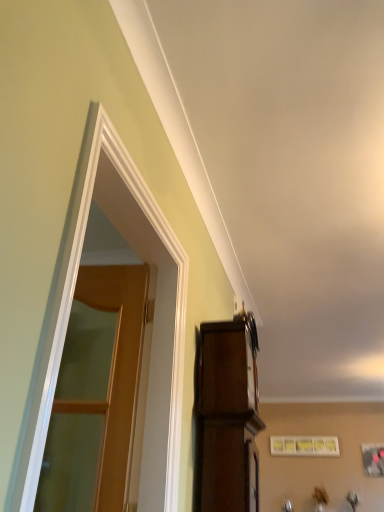
You are a GUI agent. You are given a task and a screenshot of the screen. Output one action in this format:
    pyautogui.click(x=<x>, y=<y>)
    Task: Click on the matte white picture frame at upper center
    
    Given the screenshot: What is the action you would take?
    pyautogui.click(x=304, y=445)

In order to face wooden at left, should I rotate leftwards or rightwards?

It's best to rotate left around 12.931 degrees.

This screenshot has width=384, height=512. Find the location of `dark wood cabinet at upper right`. dark wood cabinet at upper right is located at coordinates (226, 417).

Is white glossy door at left thinner than dark wood cabinet at upper right?

Yes, white glossy door at left is thinner than dark wood cabinet at upper right.

From a real-world perspective, which is physically above, white glossy door at left or dark wood cabinet at upper right?

A: white glossy door at left is physically above.

Which of these two, white glossy door at left or dark wood cabinet at upper right, is smaller?

With smaller size is dark wood cabinet at upper right.

Is wooden at left with dark wood cabinet at upper right?

No, wooden at left is not touching dark wood cabinet at upper right.

Between point (41, 485) and point (245, 335), which one is positioned behind?

Positioned behind is point (41, 485).

Considering the sizes of objects wooden at left and dark wood cabinet at upper right in the image provided, who is bigger, wooden at left or dark wood cabinet at upper right?

dark wood cabinet at upper right.

In order to click on cabinetry located below the wooden at left (from the image's perspective) in this screenshot , I will do `click(226, 417)`.

Does dark wood cabinet at upper right lie behind matte white picture frame at upper center?

No, it is in front of matte white picture frame at upper center.

Does dark wood cabinet at upper right touch matte white picture frame at upper center?

No.

In the image, is dark wood cabinet at upper right on the left side or the right side of matte white picture frame at upper center?

Clearly, dark wood cabinet at upper right is on the left of matte white picture frame at upper center in the image.

Considering the sizes of dark wood cabinet at upper right and matte white picture frame at upper center in the image, is dark wood cabinet at upper right wider or thinner than matte white picture frame at upper center?

In the image, dark wood cabinet at upper right appears to be wider than matte white picture frame at upper center.

Which is behind, matte white picture frame at upper center or white glossy door at left?

matte white picture frame at upper center is behind.

You are a GUI agent. You are given a task and a screenshot of the screen. Output one action in this format:
    pyautogui.click(x=<x>, y=<y>)
    Task: Click on the window above the matte white picture frame at upper center (from the image's perspective)
    The height and width of the screenshot is (512, 384).
    Given the screenshot: What is the action you would take?
    pyautogui.click(x=154, y=324)

From the image's perspective, is matte white picture frame at upper center located above or below white glossy door at left?

From the image's perspective, matte white picture frame at upper center appears below white glossy door at left.

Does matte white picture frame at upper center have a greater width compared to white glossy door at left?

No, matte white picture frame at upper center is not wider than white glossy door at left.

In the scene shown: Which object is positioned more to the right, wooden at left or matte white picture frame at upper center?

Positioned to the right is matte white picture frame at upper center.

From their relative heights in the image, would you say wooden at left is taller or shorter than matte white picture frame at upper center?

Clearly, wooden at left is taller compared to matte white picture frame at upper center.

From the image's perspective, is wooden at left on top of matte white picture frame at upper center?

Yes, from the image's perspective, wooden at left is over matte white picture frame at upper center.

Can you tell me how much white glossy door at left and matte white picture frame at upper center differ in facing direction?

89.5 degrees.

Is white glossy door at left not close to matte white picture frame at upper center?

Yes.

From a real-world perspective, which object stands above the other?

matte white picture frame at upper center is physically above.

Is white glossy door at left further to the viewer compared to matte white picture frame at upper center?

No, the depth of white glossy door at left is less than that of matte white picture frame at upper center.

Is dark wood cabinet at upper right taller or shorter than wooden at left?

Considering their sizes, dark wood cabinet at upper right has less height than wooden at left.

Consider the image. Which object is more forward, dark wood cabinet at upper right or wooden at left?

wooden at left is in front.

From the image's perspective, relative to wooden at left, is dark wood cabinet at upper right above or below?

dark wood cabinet at upper right is situated lower than wooden at left in the image.

Is dark wood cabinet at upper right bigger than wooden at left?

Indeed, dark wood cabinet at upper right has a larger size compared to wooden at left.

In the image, there is a white glossy door at left. Where is `cabinetry below it (from a real-world perspective)`? cabinetry below it (from a real-world perspective) is located at coordinates (226, 417).

Where is `door that is above the dark wood cabinet at upper right (from the image's perspective)`? This screenshot has height=512, width=384. door that is above the dark wood cabinet at upper right (from the image's perspective) is located at coordinates (95, 394).

When comparing their distances from dark wood cabinet at upper right, does white glossy door at left or matte white picture frame at upper center seem closer?

white glossy door at left lies closer to dark wood cabinet at upper right than the other object.

From the image, which object appears to be farther from matte white picture frame at upper center, wooden at left or white glossy door at left?

white glossy door at left is further to matte white picture frame at upper center.

From the image, which object appears to be farther from dark wood cabinet at upper right, matte white picture frame at upper center or wooden at left?

Based on the image, matte white picture frame at upper center appears to be further to dark wood cabinet at upper right.

Which object lies further to the anchor point matte white picture frame at upper center, dark wood cabinet at upper right or white glossy door at left?

white glossy door at left is positioned further to the anchor matte white picture frame at upper center.

When comparing their distances from dark wood cabinet at upper right, does wooden at left or matte white picture frame at upper center seem further?

The object further to dark wood cabinet at upper right is matte white picture frame at upper center.

Which object lies further to the anchor point dark wood cabinet at upper right, matte white picture frame at upper center or white glossy door at left?

matte white picture frame at upper center lies further to dark wood cabinet at upper right than the other object.

In the scene shown: Considering their positions, is wooden at left positioned closer to dark wood cabinet at upper right than white glossy door at left?

Based on the image, white glossy door at left appears to be nearer to dark wood cabinet at upper right.

Estimate the real-world distances between objects in this image. Which object is closer to matte white picture frame at upper center, white glossy door at left or wooden at left?

wooden at left lies closer to matte white picture frame at upper center than the other object.

This screenshot has height=512, width=384. Identify the location of cabinetry between white glossy door at left and matte white picture frame at upper center in the front-back direction. (226, 417).

Identify the location of door between white glossy door at left and matte white picture frame at upper center in the front-back direction. (95, 394).

Locate an element on the screen. cabinetry between wooden at left and matte white picture frame at upper center in the front-back direction is located at coordinates (226, 417).

The height and width of the screenshot is (512, 384). I want to click on door located between white glossy door at left and dark wood cabinet at upper right in the depth direction, so click(95, 394).